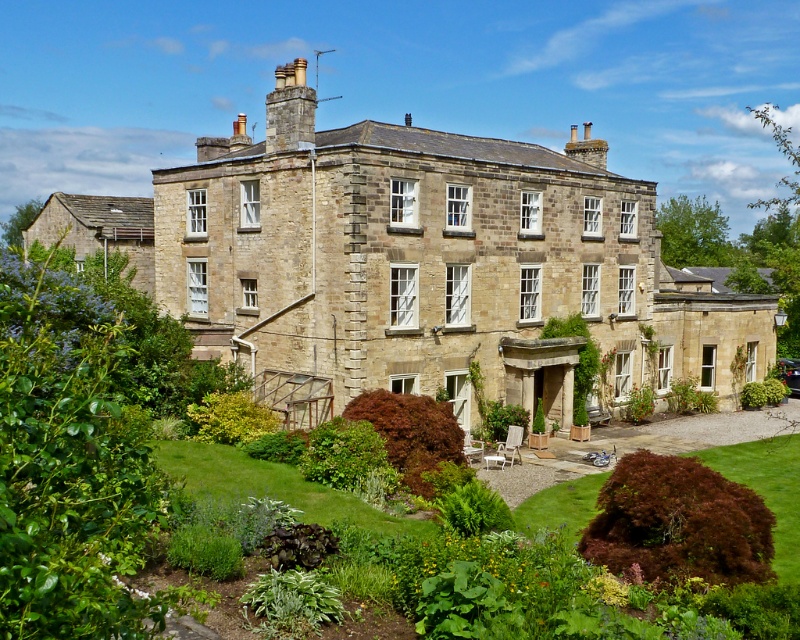
Question: Can you confirm if green grass at lower left is smaller than green grass at lower right?

Choices:
 (A) no
 (B) yes

Answer: (B)

Question: Does green grass at lower left have a greater width compared to green grass at lower right?

Choices:
 (A) no
 (B) yes

Answer: (A)

Question: Is green leafy bush at center closer to the viewer compared to stone chimney at upper center?

Choices:
 (A) no
 (B) yes

Answer: (B)

Question: Which object is farther from the camera taking this photo?

Choices:
 (A) green grass at lower right
 (B) stone chimney at upper center
 (C) green leafy bush at center
 (D) green grass at lower left

Answer: (B)

Question: Which object is the closest to the stone chimney at upper center?

Choices:
 (A) green grass at lower right
 (B) green grass at lower left
 (C) green leafy bush at center

Answer: (B)

Question: Which of the following is the farthest from the observer?

Choices:
 (A) (292, 147)
 (B) (784, 509)
 (C) (234, 452)

Answer: (A)